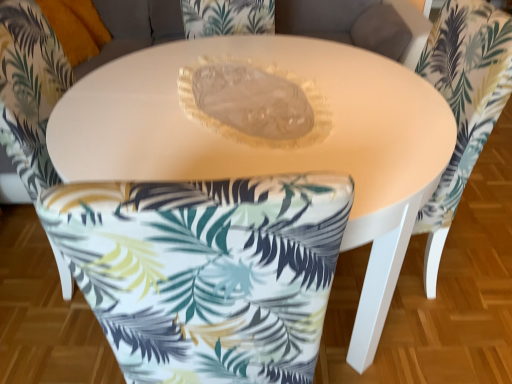
You are a GUI agent. You are given a task and a screenshot of the screen. Output one action in this format:
    pyautogui.click(x=<x>, y=<y>)
    Task: Click on the white fabric chair at center, which is the second chair from left to right
    This screenshot has width=512, height=384.
    Given the screenshot: What is the action you would take?
    pyautogui.click(x=463, y=104)

What do you see at coordinates (463, 104) in the screenshot? The height and width of the screenshot is (384, 512). I see `white fabric chair at center, which is the second chair from left to right` at bounding box center [463, 104].

The width and height of the screenshot is (512, 384). What are the coordinates of `matte white table at center` in the screenshot? It's located at [x=269, y=143].

Where is `white fabric chair at lower center, which appears as the first chair when viewed from the left`? The width and height of the screenshot is (512, 384). white fabric chair at lower center, which appears as the first chair when viewed from the left is located at coordinates (29, 90).

How different are the orientations of white fabric chair at center, which is the first chair in right-to-left order, and white fabric chair at lower center, which appears as the first chair when viewed from the left, in degrees?

170 degrees.

Could you measure the distance between white fabric chair at center, which is the first chair in right-to-left order, and white fabric chair at lower center, which is counted as the 2th chair, starting from the right?

3.91 feet.

This screenshot has height=384, width=512. Find the location of `chair above the white fabric chair at center, which is the first chair in right-to-left order (from a real-world perspective)`. chair above the white fabric chair at center, which is the first chair in right-to-left order (from a real-world perspective) is located at coordinates (29, 90).

In terms of width, does white fabric chair at center, which is the second chair from left to right, look wider or thinner when compared to white fabric chair at lower center, which appears as the first chair when viewed from the left?

white fabric chair at center, which is the second chair from left to right, is thinner than white fabric chair at lower center, which appears as the first chair when viewed from the left.

Is white fabric chair at center, which is the second chair from left to right, far away from matte white table at center?

white fabric chair at center, which is the second chair from left to right, is near matte white table at center, not far away.

At what (x,y) coordinates should I click in order to perform the action: click on chair on the right of matte white table at center. Please return your answer as a coordinate pair (x, y). Looking at the image, I should click on (463, 104).

Is white fabric chair at center, which is the first chair in right-to-left order, surrounding matte white table at center?

No, matte white table at center is located outside of white fabric chair at center, which is the first chair in right-to-left order.

Considering the sizes of objects white fabric chair at center, which is the second chair from left to right, and matte white table at center in the image provided, who is taller, white fabric chair at center, which is the second chair from left to right, or matte white table at center?

white fabric chair at center, which is the second chair from left to right.

Who is smaller, matte white table at center or white fabric chair at lower center, which appears as the first chair when viewed from the left?

white fabric chair at lower center, which appears as the first chair when viewed from the left.

Is matte white table at center to the left of white fabric chair at lower center, which is counted as the 2th chair, starting from the right, from the viewer's perspective?

In fact, matte white table at center is to the right of white fabric chair at lower center, which is counted as the 2th chair, starting from the right.

Is matte white table at center next to white fabric chair at lower center, which is counted as the 2th chair, starting from the right, and touching it?

No, matte white table at center is not in contact with white fabric chair at lower center, which is counted as the 2th chair, starting from the right.

Is matte white table at center inside or outside of white fabric chair at lower center, which appears as the first chair when viewed from the left?

The correct answer is: outside.

Can you tell me how much white fabric chair at lower center, which appears as the first chair when viewed from the left, and white fabric chair at center, which is the second chair from left to right, differ in facing direction?

170 degrees.

From the image's perspective, which one is positioned higher, white fabric chair at lower center, which is counted as the 2th chair, starting from the right, or white fabric chair at center, which is the second chair from left to right?

white fabric chair at center, which is the second chair from left to right, from the image's perspective.

Between white fabric chair at lower center, which is counted as the 2th chair, starting from the right, and white fabric chair at center, which is the second chair from left to right, which one has larger width?

white fabric chair at lower center, which is counted as the 2th chair, starting from the right, is wider.

Is white fabric chair at lower center, which appears as the first chair when viewed from the left, beside matte white table at center?

No, white fabric chair at lower center, which appears as the first chair when viewed from the left, is not next to matte white table at center.

From a real-world perspective, is white fabric chair at lower center, which is counted as the 2th chair, starting from the right, below matte white table at center?

No, from a real-world perspective, white fabric chair at lower center, which is counted as the 2th chair, starting from the right, is not under matte white table at center.

Identify the location of table directly beneath the white fabric chair at lower center, which is counted as the 2th chair, starting from the right (from a real-world perspective). This screenshot has height=384, width=512. (269, 143).

Is white fabric chair at lower center, which appears as the first chair when viewed from the left, wider or thinner than matte white table at center?

In the image, white fabric chair at lower center, which appears as the first chair when viewed from the left, appears to be more narrow than matte white table at center.

Is matte white table at center wider or thinner than white fabric chair at center, which is the second chair from left to right?

In the image, matte white table at center appears to be wider than white fabric chair at center, which is the second chair from left to right.

From a real-world perspective, is matte white table at center positioned over white fabric chair at center, which is the second chair from left to right, based on gravity?

No.

In the image, there is a white fabric chair at center, which is the first chair in right-to-left order. Find the location of `table below it (from the image's perspective)`. table below it (from the image's perspective) is located at coordinates (269, 143).

Considering the relative positions of matte white table at center and white fabric chair at center, which is the second chair from left to right, in the image provided, is matte white table at center to the right of white fabric chair at center, which is the second chair from left to right, from the viewer's perspective?

Incorrect, matte white table at center is not on the right side of white fabric chair at center, which is the second chair from left to right.

This screenshot has width=512, height=384. Identify the location of chair that appears below the white fabric chair at center, which is the second chair from left to right (from the image's perspective). (29, 90).

Find the location of `table on the left of white fabric chair at center, which is the second chair from left to right`. table on the left of white fabric chair at center, which is the second chair from left to right is located at coordinates (269, 143).

In the scene shown: Looking at the image, which one is located closer to matte white table at center, white fabric chair at lower center, which appears as the first chair when viewed from the left, or white fabric chair at center, which is the first chair in right-to-left order?

white fabric chair at center, which is the first chair in right-to-left order, lies closer to matte white table at center than the other object.

Which object lies nearer to the anchor point white fabric chair at center, which is the first chair in right-to-left order, white fabric chair at lower center, which is counted as the 2th chair, starting from the right, or matte white table at center?

Among the two, matte white table at center is located nearer to white fabric chair at center, which is the first chair in right-to-left order.

From the image, which object appears to be nearer to white fabric chair at lower center, which appears as the first chair when viewed from the left, matte white table at center or white fabric chair at center, which is the first chair in right-to-left order?

matte white table at center.

Estimate the real-world distances between objects in this image. Which object is further from white fabric chair at center, which is the second chair from left to right, matte white table at center or white fabric chair at lower center, which is counted as the 2th chair, starting from the right?

white fabric chair at lower center, which is counted as the 2th chair, starting from the right, lies further to white fabric chair at center, which is the second chair from left to right, than the other object.

Estimate the real-world distances between objects in this image. Which object is further from white fabric chair at lower center, which appears as the first chair when viewed from the left, white fabric chair at center, which is the first chair in right-to-left order, or matte white table at center?

white fabric chair at center, which is the first chair in right-to-left order, is further to white fabric chair at lower center, which appears as the first chair when viewed from the left.

Which object lies nearer to the anchor point matte white table at center, white fabric chair at center, which is the second chair from left to right, or white fabric chair at lower center, which is counted as the 2th chair, starting from the right?

white fabric chair at center, which is the second chair from left to right, is closer to matte white table at center.

Find the location of a particular element. table situated between white fabric chair at lower center, which appears as the first chair when viewed from the left, and white fabric chair at center, which is the second chair from left to right, from left to right is located at coordinates click(x=269, y=143).